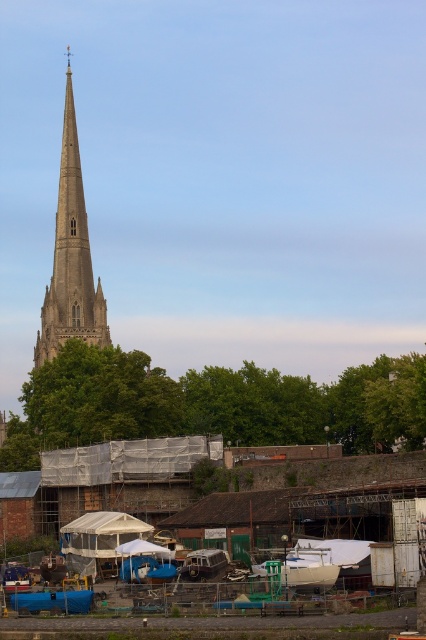
You are an architect visiting a historical site. You observe the smooth stone spire at left and the white matte boat at center. Which structure appears larger in the image?

The smooth stone spire at left is bigger than the white matte boat at center, so the spire appears larger in the image.

You are a drone operator tasked with capturing aerial footage of the smooth stone spire at left and the white matte boat at center. Your drone has a maximum range of 70 meters. Can your drone safely fly from the spire to the boat without exceeding its range?

The smooth stone spire at left is 71.05 meters away from the white matte boat at center. Since the drone has a maximum range of 70 meters, it cannot safely fly from the spire to the boat without exceeding its range.